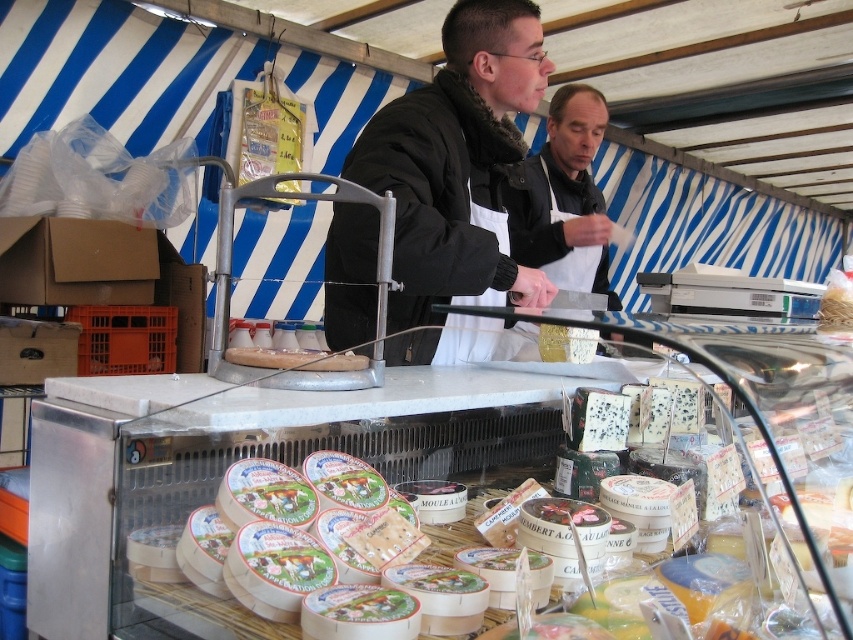
You are a customer at the market stall and want to approach the vendor. From your current position at point (512, 0), which direction should you move to reach the vendor standing at point (485, 432)?

You should move forward to reach the vendor standing at point (485, 432) because it is in front of your current position at point (512, 0).

You are a customer at the market stall and want to locate the white creamy cheese at center. According to the stall layout, where would you find it?

The white creamy cheese at center is located at the 2D coordinates point (303, 472) in the stall layout.